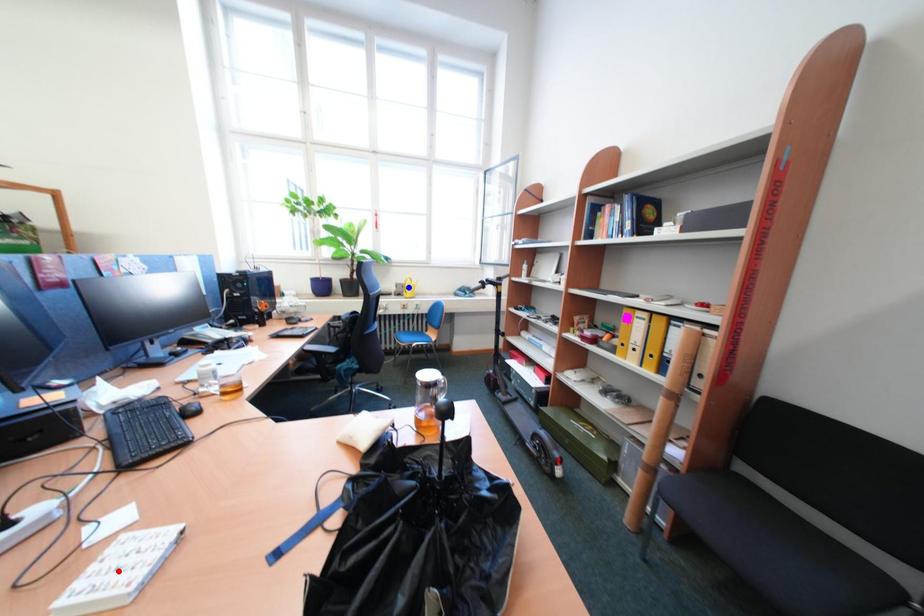
Question: Two points are marked on the image. Which point is closer to the camera?

Choices:
 (A) Blue point is closer.
 (B) Red point is closer.

Answer: (B)